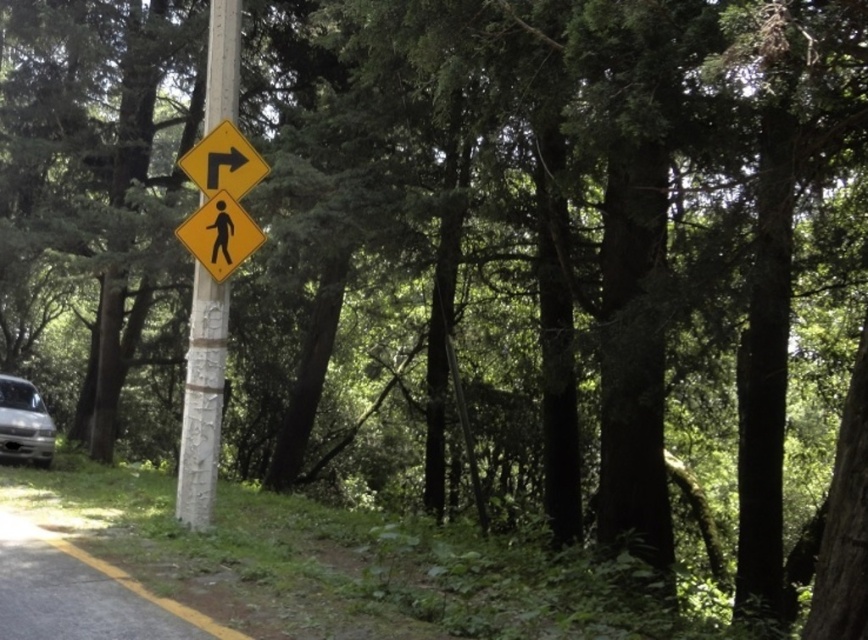
Between white painted wood pole at center and silver metallic van at lower left, which one appears on the left side from the viewer's perspective?

From the viewer's perspective, silver metallic van at lower left appears more on the left side.

Can you confirm if white painted wood pole at center is shorter than silver metallic van at lower left?

Yes.

Who is more forward, [202,284] or [33,444]?

Point [202,284] is in front.

I want to click on white painted wood pole at center, so (202, 401).

Is yellow matte pedestrian crossing sign at upper center shorter than silver metallic van at lower left?

Yes.

In the scene shown: Is yellow matte pedestrian crossing sign at upper center to the right of silver metallic van at lower left from the viewer's perspective?

Correct, you'll find yellow matte pedestrian crossing sign at upper center to the right of silver metallic van at lower left.

What are the coordinates of `yellow matte pedestrian crossing sign at upper center` in the screenshot? It's located at (222, 163).

How much distance is there between yellow plastic pedestrian sign at upper center and yellow matte pedestrian crossing sign at upper center?

14.22 inches

Between yellow plastic pedestrian sign at upper center and yellow matte pedestrian crossing sign at upper center, which one has more height?

yellow plastic pedestrian sign at upper center

Is point (222, 193) farther from camera compared to point (189, 177)?

That is True.

I want to click on yellow plastic pedestrian sign at upper center, so click(x=219, y=236).